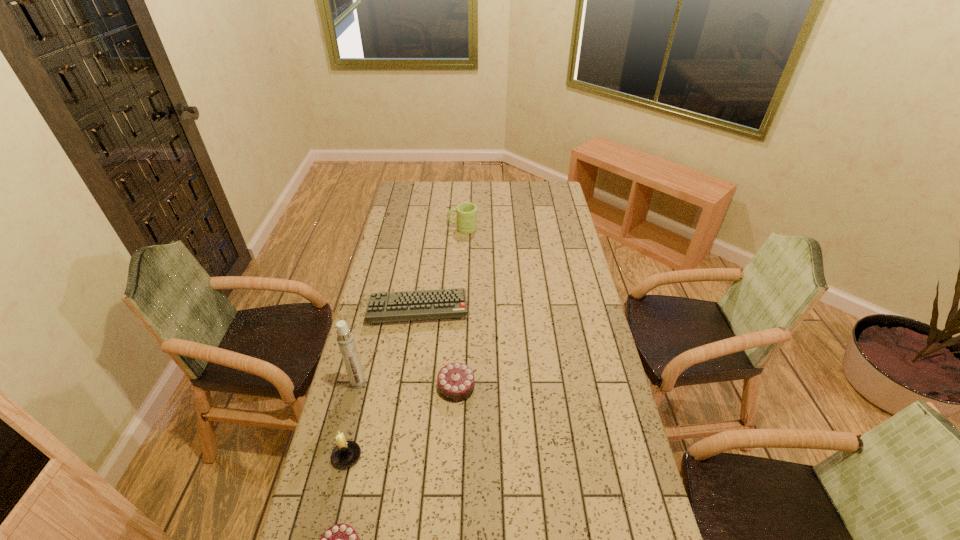
Where is `the farther chocolate cake`? The height and width of the screenshot is (540, 960). the farther chocolate cake is located at coordinates (455, 381).

Image resolution: width=960 pixels, height=540 pixels. I want to click on the fourth tallest object, so click(x=455, y=381).

Where is `the farthest object`? This screenshot has width=960, height=540. the farthest object is located at coordinates (466, 222).

Identify the location of the tallest object. (345, 339).

Find the location of a particular element. This screenshot has width=960, height=540. computer keyboard is located at coordinates (441, 303).

The width and height of the screenshot is (960, 540). What are the coordinates of `the fifth farthest object` in the screenshot? It's located at (346, 453).

The image size is (960, 540). I want to click on free space located 0.130m on the left of the third shortest object, so click(399, 387).

You are a GUI agent. You are given a task and a screenshot of the screen. Output one action in this format:
    pyautogui.click(x=<x>, y=<y>)
    Task: Click on the vacant space located 0.080m on the side of the farthest object with the handle
    Image resolution: width=960 pixels, height=540 pixels.
    Given the screenshot: What is the action you would take?
    pyautogui.click(x=432, y=228)

Locate an element on the screen. vacant region located on the side of the farthest object with the handle is located at coordinates (420, 228).

At what (x,y) coordinates should I click in order to perform the action: click on vacant space located 0.120m on the side of the farthest object with the handle. Please return your answer as a coordinate pair (x, y). The width and height of the screenshot is (960, 540). Looking at the image, I should click on (423, 228).